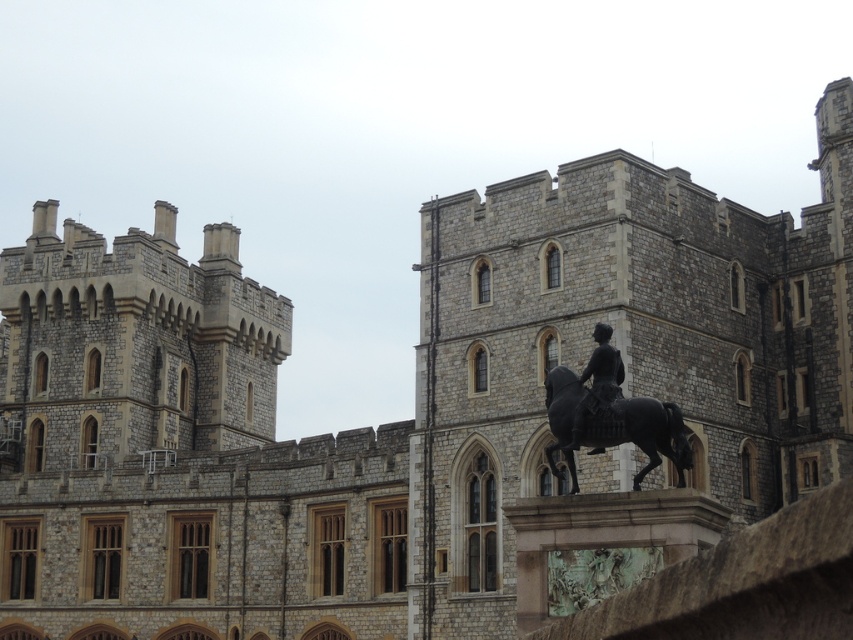
You are a tour guide explaining the historic stone building to visitors. You point out the shiny black horse at center and the polished bronze statue at center. Which one is located to the right of the other?

The shiny black horse at center is positioned on the right side of the polished bronze statue at center.

You are a tour guide leading a group around the historic stone building. You want to ensure that visitors can comfortably walk between the shiny black horse at center and the polished bronze statue at center. If the average person requires 2.5 feet of space to walk comfortably, is there enough space between the two objects?

The shiny black horse at center and polished bronze statue at center are 5.16 feet apart. Since the required space for comfortable walking is 2.5 feet, the distance between them is more than sufficient, so yes, there is enough space.

Looking at this image, you are standing at the entrance of the historic stone building and notice two points marked on the ground. The first point is at coordinate point (682, 461) and the second is at point (584, 372). Which point is closer to you?

Point (682, 461) is in front of point (584, 372), so it is closer to you.